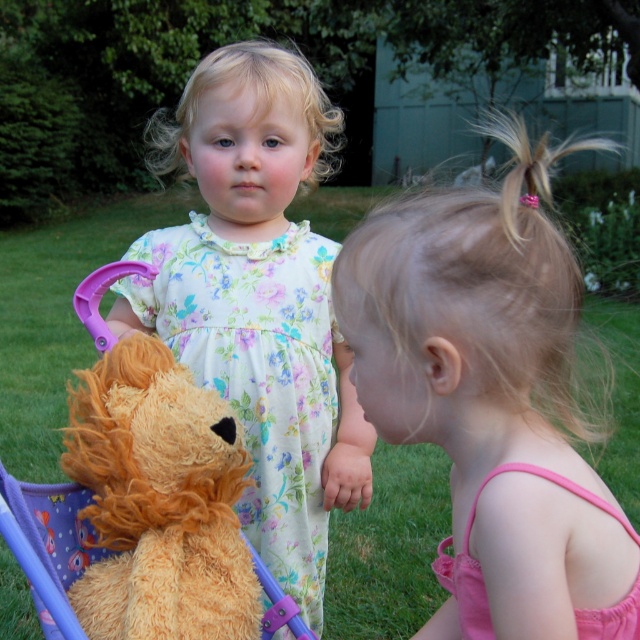
You are a photographer setting up a shot of the two children and their toys. You want to position a light source to the left of the fuzzy orange teddy bear at left so it casts a shadow on the fluffy white dress at center. Is this possible given their positions?

The fluffy white dress at center is to the right of the fuzzy orange teddy bear at left. Since the light source is placed to the left of the teddy bear, the shadow would extend towards the right side, which would reach the fluffy white dress at center. Therefore, yes, positioning the light source there would cast a shadow on the fluffy white dress at center.

You are a photographer setting up for a family photo. You need to position the fluffy white dress at center and the pink satin dress at lower right so that both are visible in the frame. Considering their heights, which dress should be placed closer to the front to ensure both are fully visible?

The pink satin dress at lower right should be placed closer to the front since the fluffy white dress at center is much taller, allowing both dresses to be fully visible in the frame.

You are a photographer trying to capture a photo of the fluffy white dress at center and the fuzzy orange teddy bear at left. Based on their positions, which object is higher in the image?

The fluffy white dress at center is higher in the image than the fuzzy orange teddy bear at left because the description states that the fluffy white dress at center is above the fuzzy orange teddy bear at left.